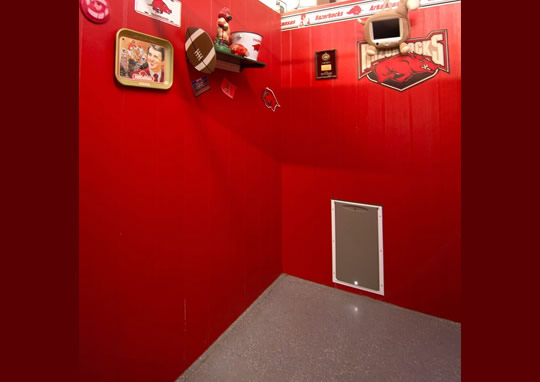
This screenshot has height=382, width=540. Identify the location of monitor cover. (384, 14).